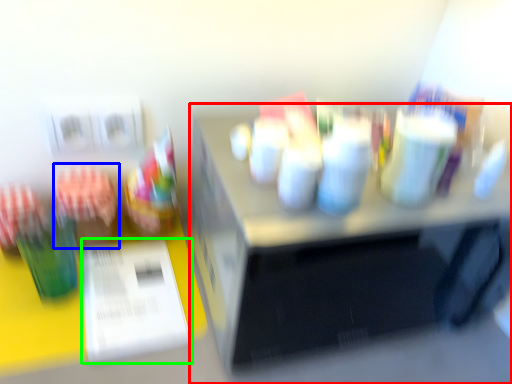
Question: Which object is positioned farthest from desk (highlighted by a red box)? Select from stationery (highlighted by a blue box) and paper (highlighted by a green box).

Choices:
 (A) stationery
 (B) paper

Answer: (A)